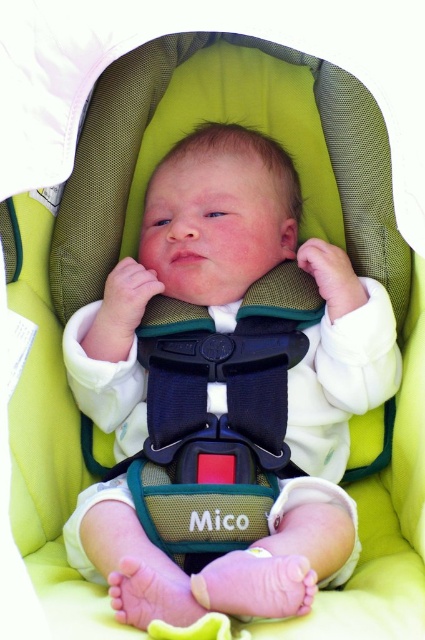
Question: Observing the image, what is the correct spatial positioning of white soft baby at center in reference to black plastic buckle at center?

Choices:
 (A) right
 (B) left

Answer: (A)

Question: Can you confirm if white soft baby at center is thinner than black plastic buckle at center?

Choices:
 (A) no
 (B) yes

Answer: (A)

Question: Which point is farther from the camera taking this photo?

Choices:
 (A) (98, 412)
 (B) (246, 362)

Answer: (A)

Question: Observing the image, what is the correct spatial positioning of white soft baby at center in reference to black plastic buckle at center?

Choices:
 (A) below
 (B) above

Answer: (B)